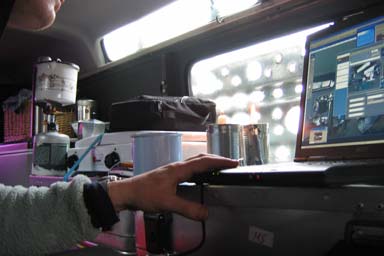
Where is `bottle`? bottle is located at coordinates (56, 137).